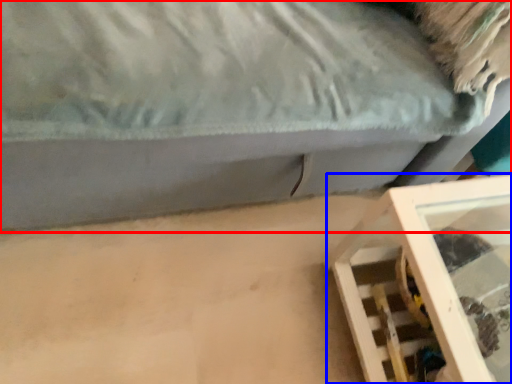
Question: Which object is further to the camera taking this photo, furniture (highlighted by a red box) or furniture (highlighted by a blue box)?

Choices:
 (A) furniture
 (B) furniture

Answer: (B)